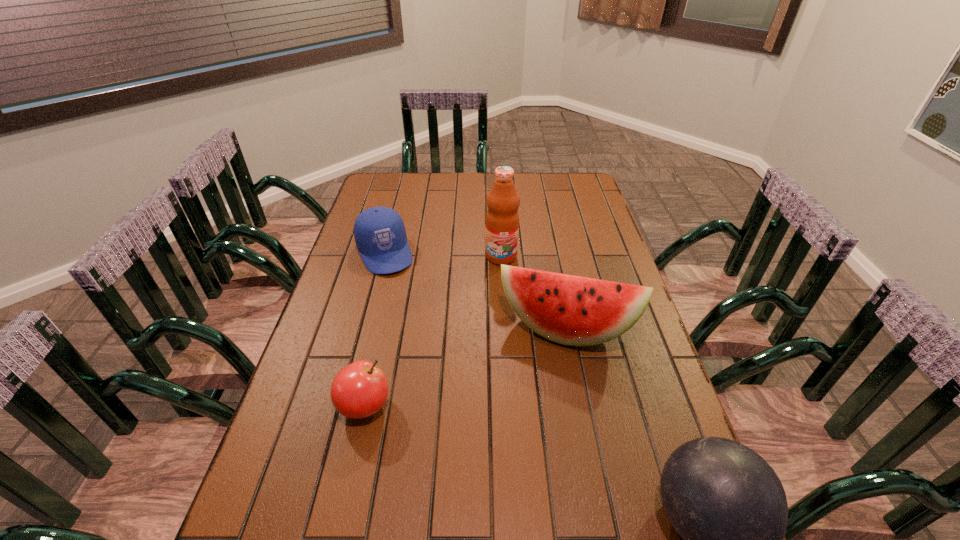
Identify the location of blank space located 0.350m on the outer rind of the watermelon. Image resolution: width=960 pixels, height=540 pixels. (532, 485).

Locate an element on the screen. The image size is (960, 540). free space located 0.250m on the front-facing side of the cap is located at coordinates 415,327.

The image size is (960, 540). What are the coordinates of `free space located 0.350m on the front-facing side of the cap` in the screenshot? It's located at (426, 353).

Identify the location of free space located on the front-facing side of the cap. The width and height of the screenshot is (960, 540). (402, 300).

In order to click on apple that is at the left edge in this screenshot , I will do `click(359, 390)`.

The width and height of the screenshot is (960, 540). In order to click on cap located in the left edge section of the desktop in this screenshot , I will do `click(379, 232)`.

The image size is (960, 540). In order to click on object that is at the right edge in this screenshot , I will do `click(571, 310)`.

You are a GUI agent. You are given a task and a screenshot of the screen. Output one action in this format:
    pyautogui.click(x=<x>, y=<y>)
    Task: Click on the vacant region at the far edge of the desktop
    Image resolution: width=960 pixels, height=540 pixels.
    Given the screenshot: What is the action you would take?
    pyautogui.click(x=465, y=196)

Find the location of a particular element. Image resolution: width=960 pixels, height=540 pixels. free space at the near edge is located at coordinates (565, 521).

In the image, there is a desktop. In order to click on free space at the right edge in this screenshot , I will do `click(593, 235)`.